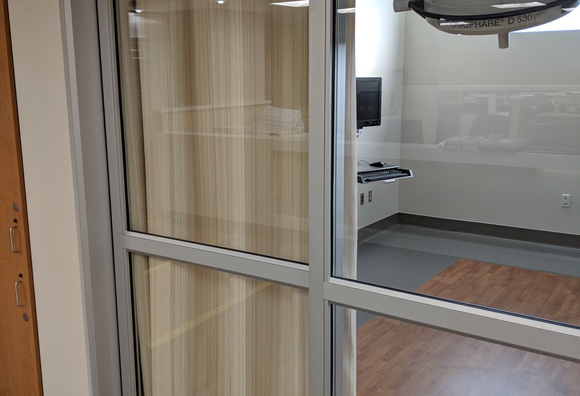
Identify the location of long curtain. (233, 67), (223, 219), (235, 370).